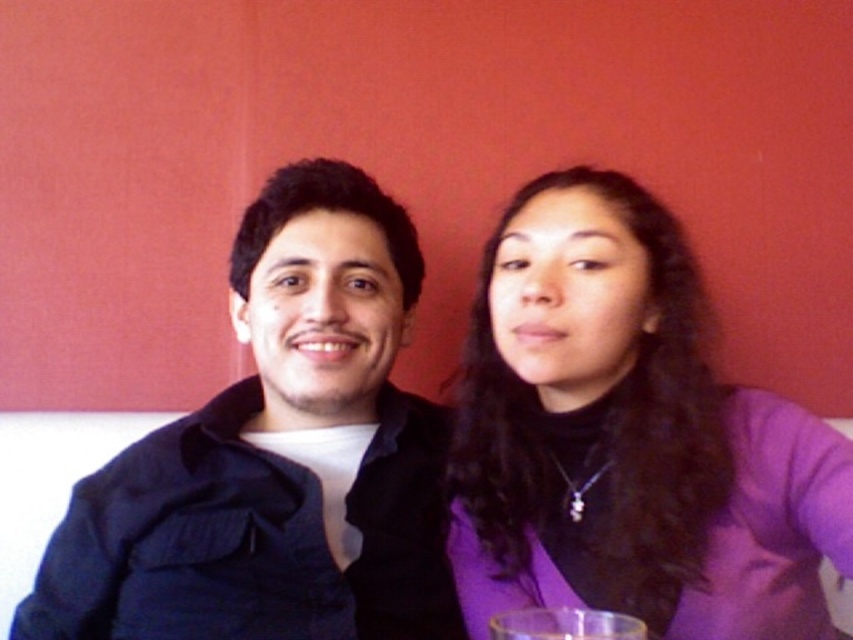
Does matte black shirt at center have a lesser height compared to transparent glass at lower center?

Incorrect, matte black shirt at center's height does not fall short of transparent glass at lower center's.

This screenshot has height=640, width=853. Find the location of `matte black shirt at center`. matte black shirt at center is located at coordinates (276, 456).

This screenshot has width=853, height=640. What are the coordinates of `matte black shirt at center` in the screenshot? It's located at (276, 456).

Who is positioned more to the left, purple matte sweater at center or matte black shirt at center?

matte black shirt at center is more to the left.

Can you confirm if purple matte sweater at center is shorter than matte black shirt at center?

Correct, purple matte sweater at center is not as tall as matte black shirt at center.

Who is more forward, (543, 468) or (309, 492)?

Point (309, 492) is more forward.

Find the location of a particular element. This screenshot has width=853, height=640. purple matte sweater at center is located at coordinates (630, 436).

Which is in front, point (706, 490) or point (643, 637)?

Point (643, 637) is more forward.

Does point (462, 481) come in front of point (560, 609)?

No, (462, 481) is further to viewer.

You are a GUI agent. You are given a task and a screenshot of the screen. Output one action in this format:
    pyautogui.click(x=<x>, y=<y>)
    Task: Click on the purple matte sweater at center
    This screenshot has width=853, height=640.
    Given the screenshot: What is the action you would take?
    pyautogui.click(x=630, y=436)